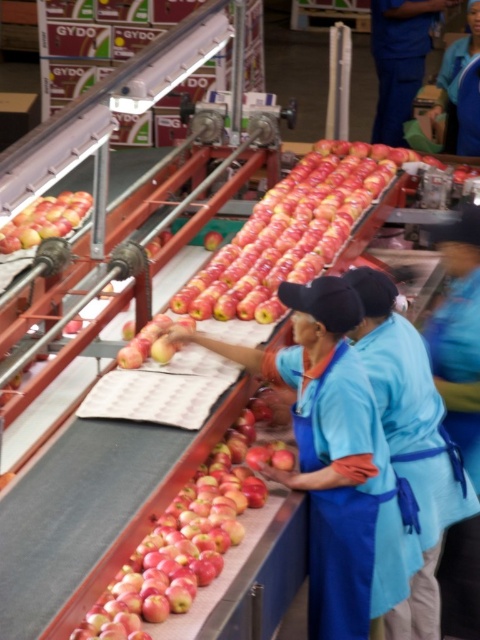
You are a quality inspector in the fruit processing facility. You need to access the glossy red apple at center for inspection. Is the blue fabric apron at center blocking your direct access to it?

The blue fabric apron at center is positioned over the glossy red apple at center, so yes, the apron is blocking direct access to the apple.

You are an apple inspector standing at the center of the conveyor belt. You see a matte blue apron at center and a glossy red apple at center. Which object is located to the right of the other?

The matte blue apron at center is positioned on the right side of glossy red apple at center, so the matte blue apron at center is to the right of the glossy red apple at center.